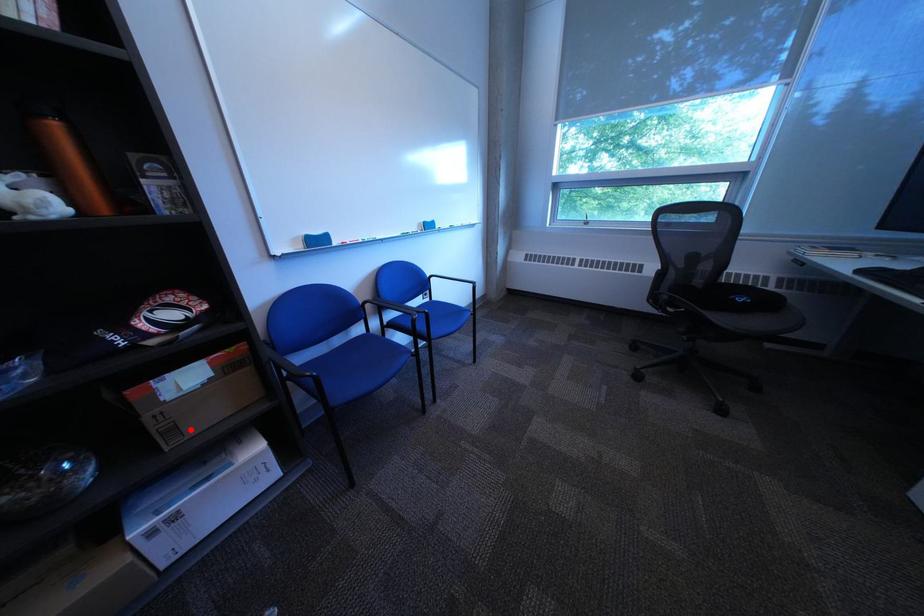
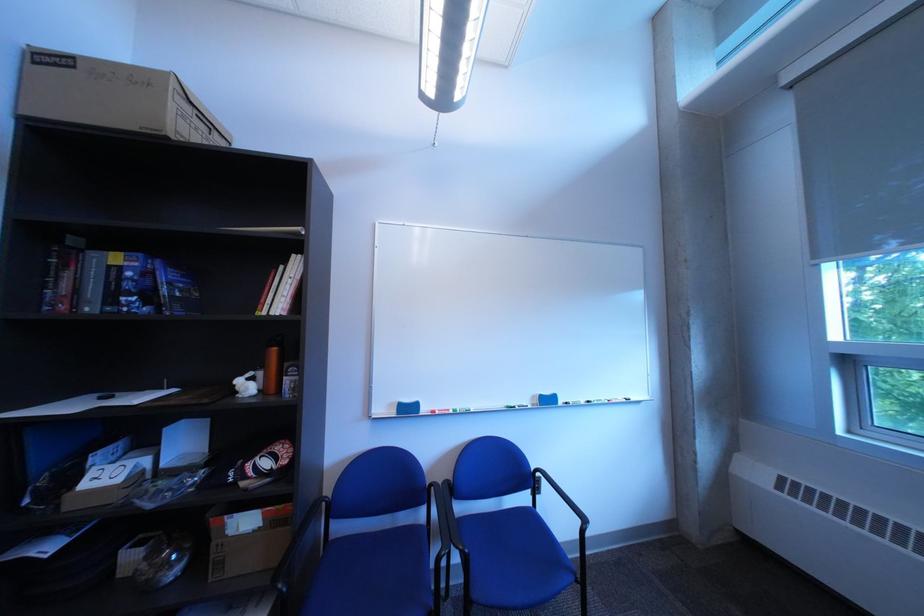
In the second image, find the point that corresponds to the highlighted location in the first image.

(237, 565)